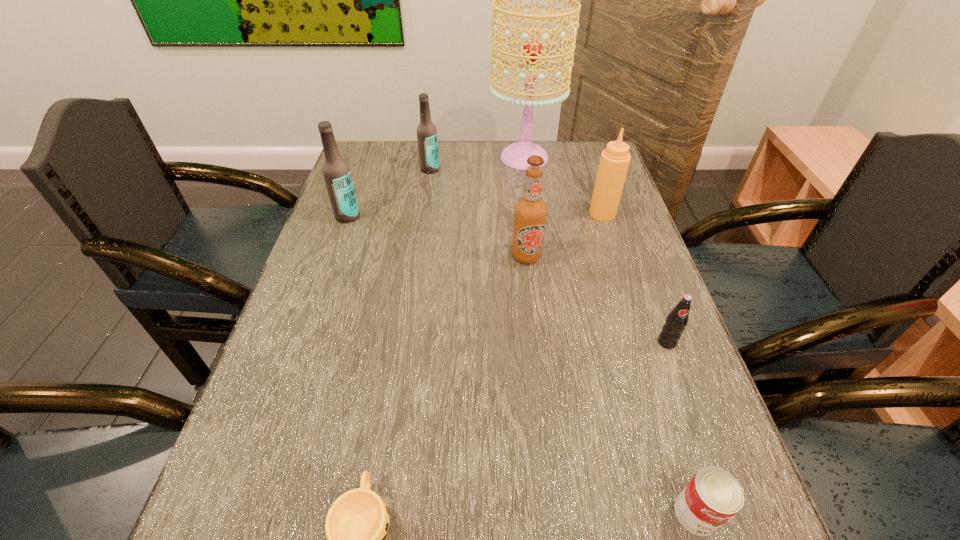
The width and height of the screenshot is (960, 540). Identify the location of lampshade located at the right edge. (515, 155).

At what (x,y) coordinates should I click in order to perform the action: click on condiment that is at the right edge. Please return your answer as a coordinate pair (x, y). Looking at the image, I should click on (615, 159).

At what (x,y) coordinates should I click in order to perform the action: click on pop present at the right edge. Please return your answer as a coordinate pair (x, y). Image resolution: width=960 pixels, height=540 pixels. Looking at the image, I should click on (677, 320).

In order to click on can that is at the right edge in this screenshot , I will do `click(713, 496)`.

Image resolution: width=960 pixels, height=540 pixels. Find the location of `object that is at the far right corner`. object that is at the far right corner is located at coordinates (515, 155).

Identify the location of object that is at the near right corner. The image size is (960, 540). (713, 496).

Locate an element on the screen. vacant space at the far edge of the desktop is located at coordinates (460, 166).

Locate an element on the screen. The image size is (960, 540). blank space at the left edge is located at coordinates [357, 330].

Identify the location of vacant region at the right edge. (638, 311).

Locate an element on the screen. Image resolution: width=960 pixels, height=540 pixels. free space at the near left corner of the desktop is located at coordinates (242, 529).